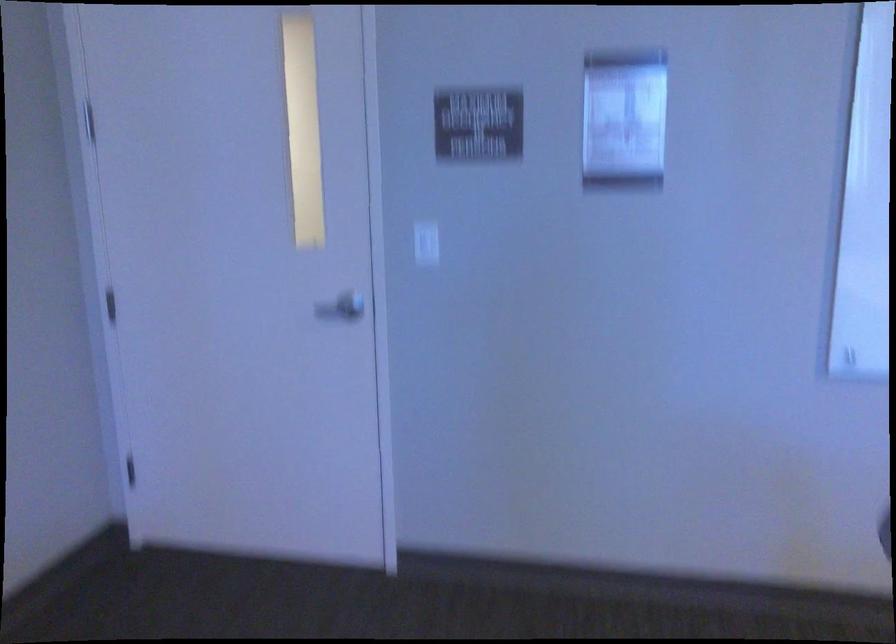
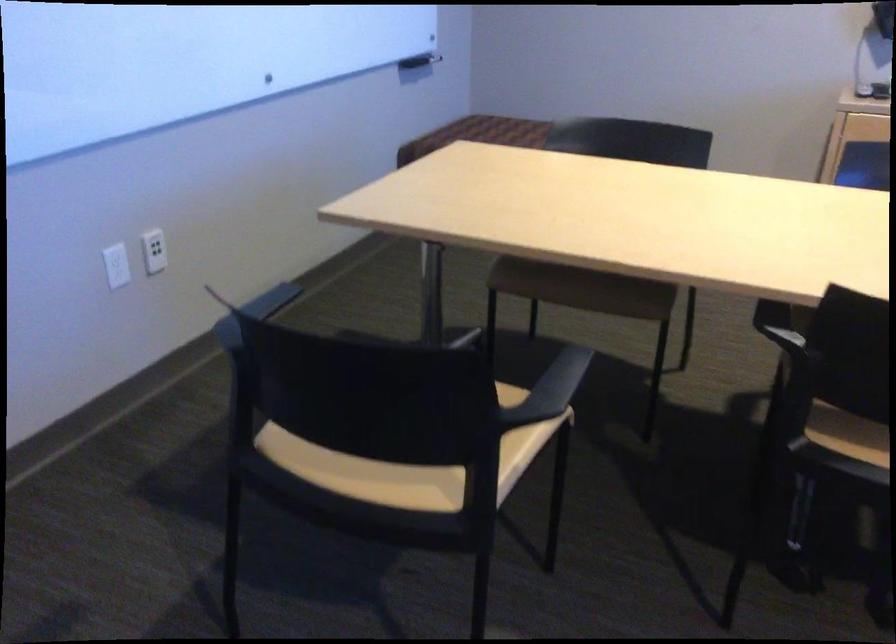
Based on the continuous images, in which direction is the camera rotating?

The rotation direction of the camera is right-down.